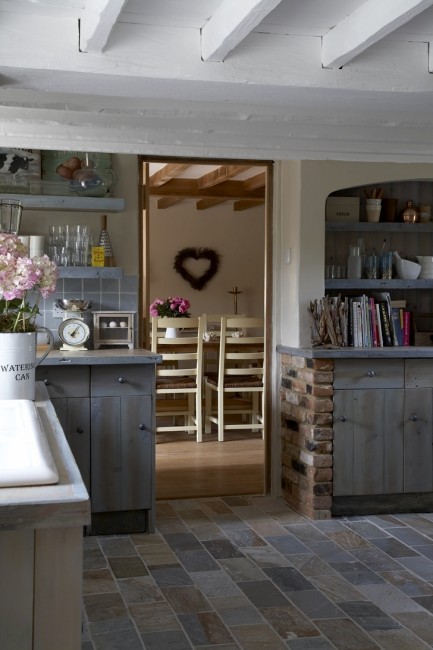
Where is `bottle`? This screenshot has width=433, height=650. bottle is located at coordinates (104, 237).